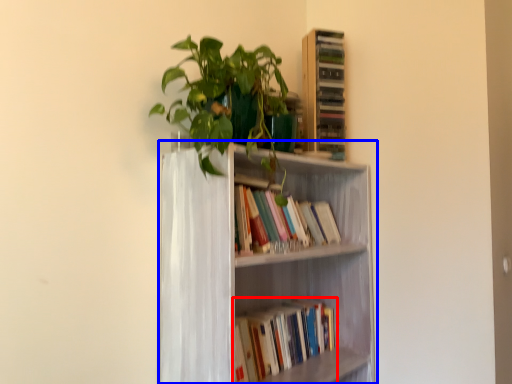
Question: Which object appears closest to the camera in this image, book (highlighted by a red box) or bookcase (highlighted by a blue box)?

Choices:
 (A) book
 (B) bookcase

Answer: (B)